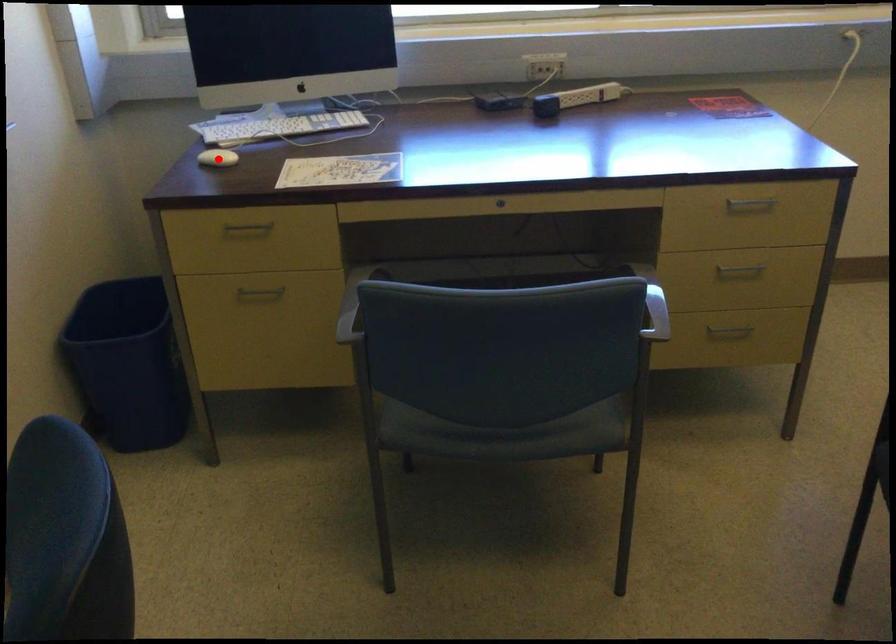
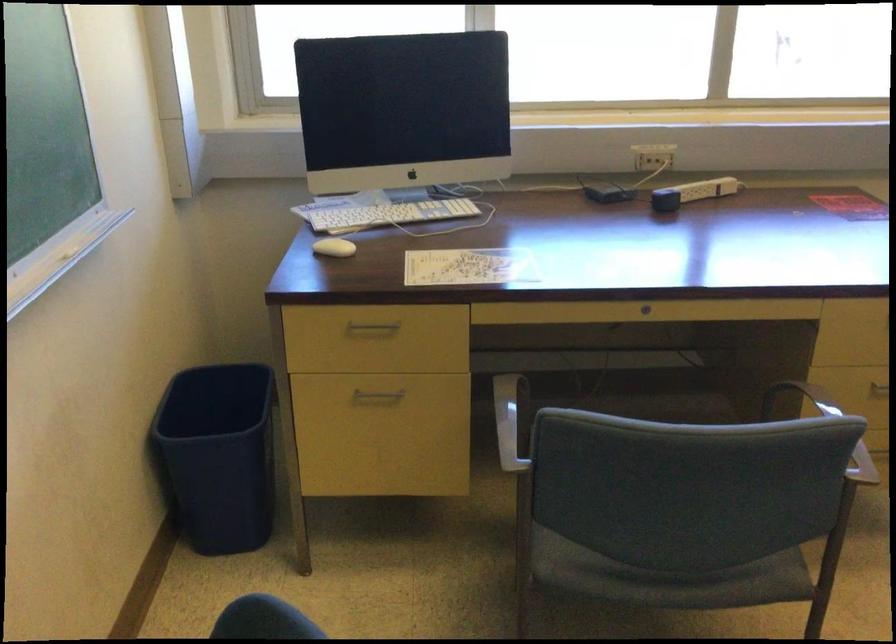
Where in the second image is the point corresponding to the highlighted location from the first image?

(333, 247)